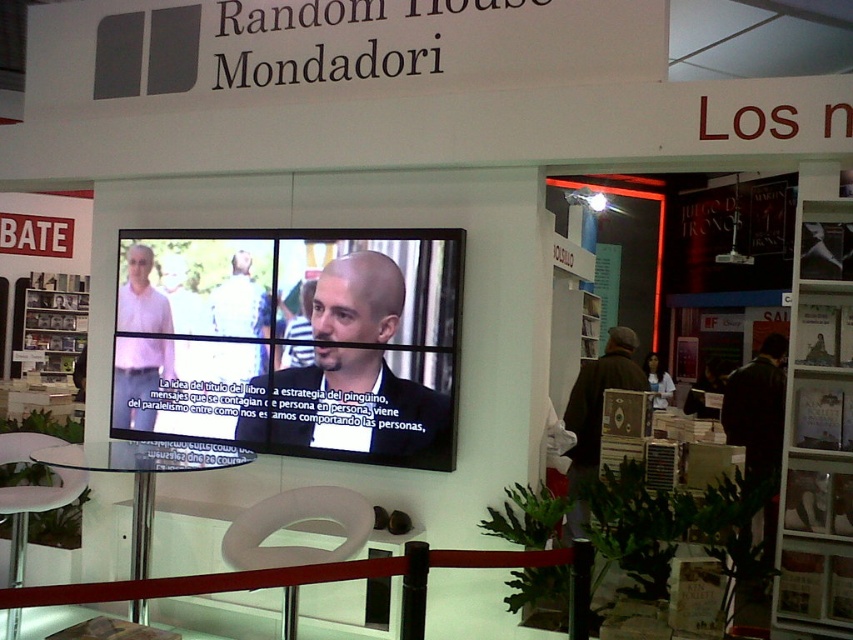
Does matte black suit at center have a larger size compared to dark brown leather jacket at lower right?

Actually, matte black suit at center might be smaller than dark brown leather jacket at lower right.

Between matte black suit at center and dark brown leather jacket at lower right, which one is positioned lower?

dark brown leather jacket at lower right is lower down.

Which is behind, point (352, 330) or point (573, 428)?

Positioned behind is point (573, 428).

Identify the location of matte black suit at center. This screenshot has width=853, height=640. (345, 406).

Is white wood bookshelf at center right further to camera compared to dark brown leather jacket at lower right?

No, it is not.

Is the position of white wood bookshelf at center right less distant than that of dark brown leather jacket at lower right?

Yes, it is.

Image resolution: width=853 pixels, height=640 pixels. In order to click on white wood bookshelf at center right in this screenshot , I will do `click(817, 442)`.

Where is `white wood bookshelf at center right`? Image resolution: width=853 pixels, height=640 pixels. white wood bookshelf at center right is located at coordinates (817, 442).

Can you confirm if matte black suit at center is smaller than matte white shirt at upper left?

No, matte black suit at center is not smaller than matte white shirt at upper left.

Is matte black suit at center below matte white shirt at upper left?

Correct, matte black suit at center is located below matte white shirt at upper left.

The width and height of the screenshot is (853, 640). Describe the element at coordinates (345, 406) in the screenshot. I see `matte black suit at center` at that location.

I want to click on matte black suit at center, so click(x=345, y=406).